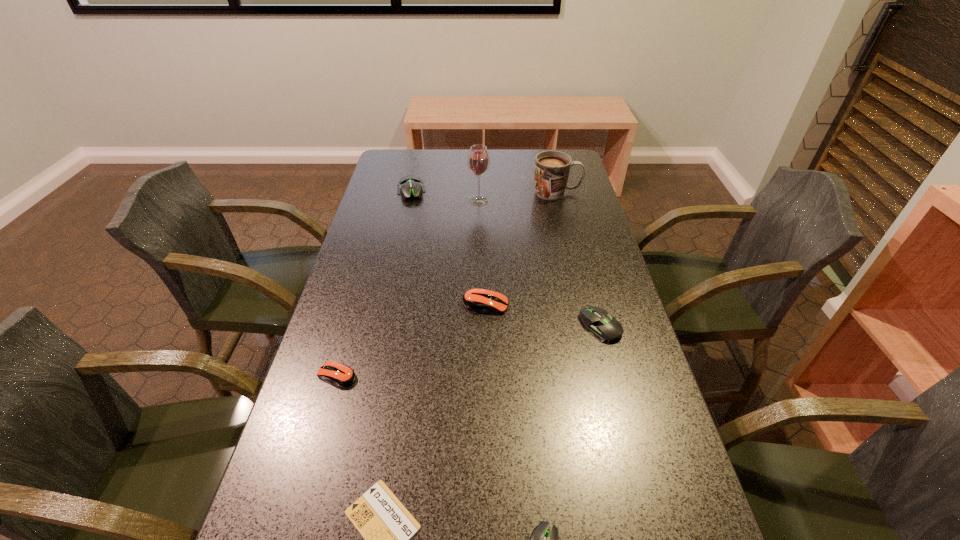
Locate an element on the screen. This screenshot has height=540, width=960. blank space at the far left corner of the desktop is located at coordinates 408,152.

What are the coordinates of `free space between the mug and the second farthest gray computer mouse` in the screenshot? It's located at (579, 259).

This screenshot has width=960, height=540. I want to click on vacant space that's between the second farthest gray computer mouse and the biggest gray computer mouse, so click(506, 258).

Locate an element on the screen. empty space that is in between the farthest gray computer mouse and the fourth farthest computer mouse is located at coordinates (374, 283).

Image resolution: width=960 pixels, height=540 pixels. Identify the location of free space between the farther orange computer mouse and the mug. (x=521, y=248).

Identify which object is the nearest to the bigger orange computer mouse. Please provide its 2D coordinates. Your answer should be formatted as a tuple, i.e. [(x, y)], where the tuple contains the x and y coordinates of a point satisfying the conditions above.

[(603, 327)]

Select which object appears as the fourth closest to the tallest object. Please provide its 2D coordinates. Your answer should be formatted as a tuple, i.e. [(x, y)], where the tuple contains the x and y coordinates of a point satisfying the conditions above.

[(603, 327)]

Locate which computer mouse is the second closest to the second nearest gray computer mouse. Please provide its 2D coordinates. Your answer should be formatted as a tuple, i.e. [(x, y)], where the tuple contains the x and y coordinates of a point satisfying the conditions above.

[(542, 539)]

Find the location of a particular element. The height and width of the screenshot is (540, 960). computer mouse that can be found as the second closest to the smallest gray computer mouse is located at coordinates (341, 375).

Identify which gray computer mouse is the nearest to the tallest object. Please provide its 2D coordinates. Your answer should be formatted as a tuple, i.e. [(x, y)], where the tuple contains the x and y coordinates of a point satisfying the conditions above.

[(409, 185)]